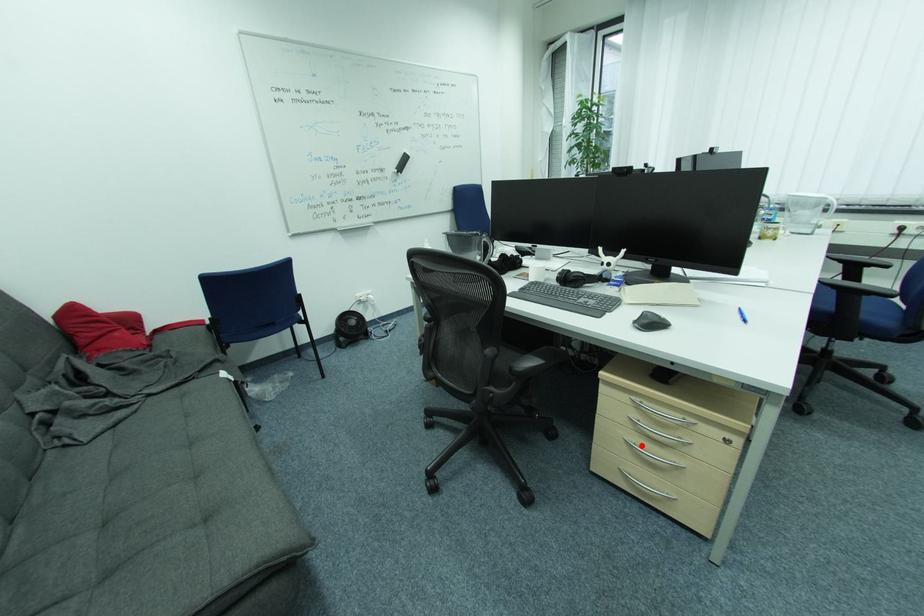
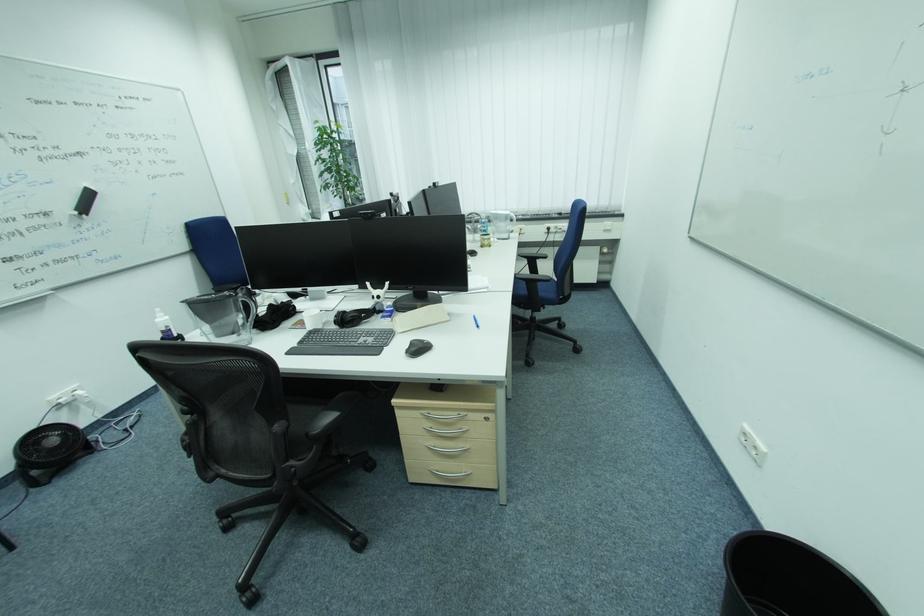
Question: I am providing you with two images of the same scene from different viewpoints. Given a red point in image1, look at the same physical point in image2. Is it:

Choices:
 (A) Closer to the viewpoint
 (B) Farther from the viewpoint

Answer: (B)